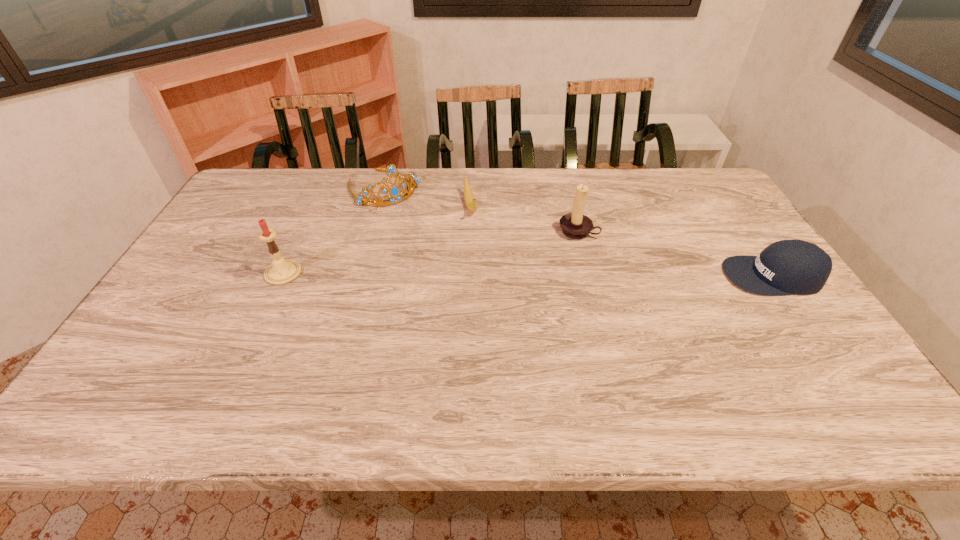
The image size is (960, 540). Identify the location of free space that satisfies the following two spatial constraints: 1. on the front side of the banana; 2. on the front-facing side of the baseball cap. [x=468, y=276].

Image resolution: width=960 pixels, height=540 pixels. What are the coordinates of `vacant region that satisfies the following two spatial constraints: 1. on the front side of the rightmost object; 2. on the front-facing side of the fourth object from left to right` in the screenshot? It's located at (589, 276).

Where is `free spot that satisfies the following two spatial constraints: 1. on the front side of the candle holder; 2. on the front-facing side of the baseball cap`? Image resolution: width=960 pixels, height=540 pixels. free spot that satisfies the following two spatial constraints: 1. on the front side of the candle holder; 2. on the front-facing side of the baseball cap is located at coordinates (589, 276).